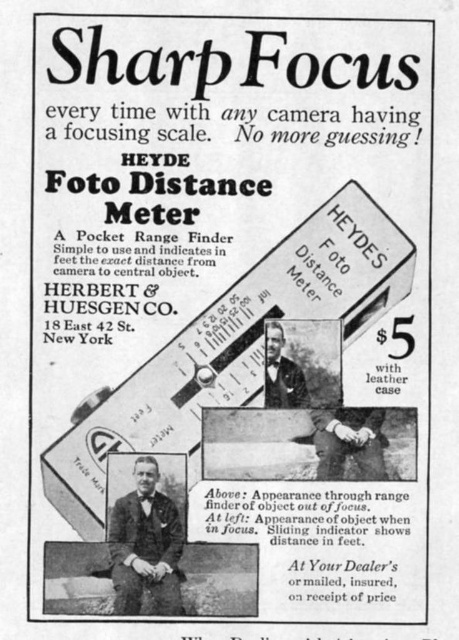
Question: Can you confirm if black suit at center is positioned to the left of black leather jacket at center?

Choices:
 (A) no
 (B) yes

Answer: (B)

Question: Which of the following is the closest to the observer?

Choices:
 (A) (332, 476)
 (B) (119, 596)

Answer: (B)

Question: Which point is farther to the camera?

Choices:
 (A) light brown leather gloves at center
 (B) black leather jacket at center
 (C) black suit at center

Answer: (A)

Question: Is black suit at center thinner than light brown leather gloves at center?

Choices:
 (A) yes
 (B) no

Answer: (A)

Question: Is black suit at center to the right of black leather jacket at center from the viewer's perspective?

Choices:
 (A) yes
 (B) no

Answer: (B)

Question: Which point appears closest to the camera in this image?

Choices:
 (A) (273, 358)
 (B) (329, 412)

Answer: (A)